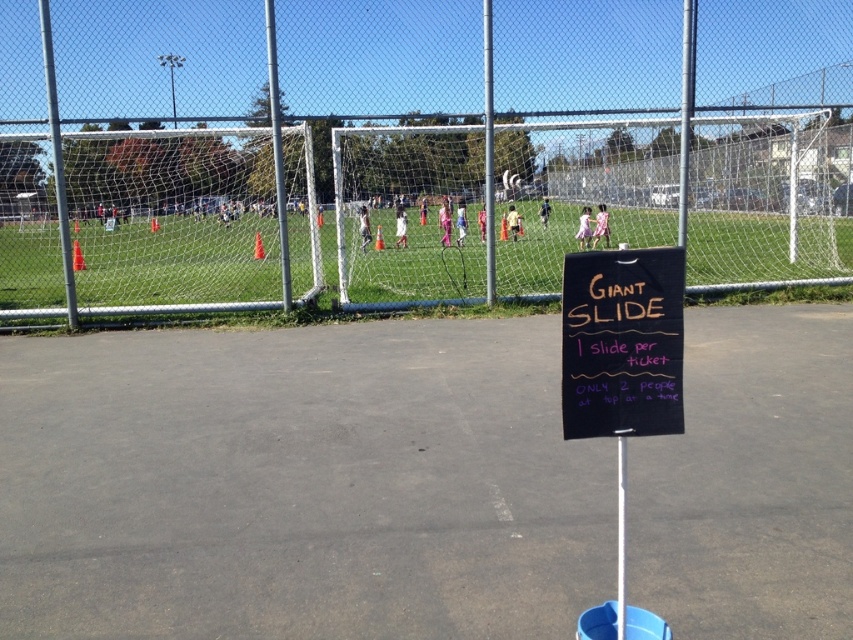
You are planning to install a new sign that is 2 meters tall. The current black chalkboard at center and metallic silver pole at center are in the way. Which object do you need to move to make space for the new sign?

The black chalkboard at center is not as tall as the metallic silver pole at center, so you need to move the metallic silver pole at center to make space for the new sign since it is taller and might block the new sign.